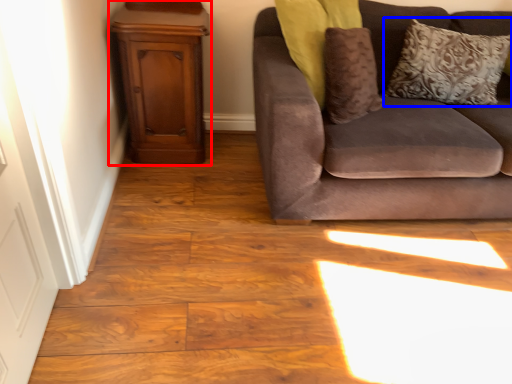
Question: Which object is closer to the camera taking this photo, dresser (highlighted by a red box) or pillow (highlighted by a blue box)?

Choices:
 (A) dresser
 (B) pillow

Answer: (A)